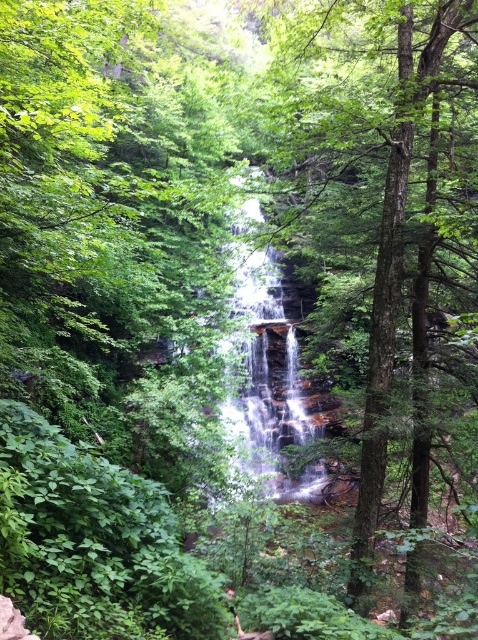
You are a photographer standing at the edge of the forest, aiming to capture a closeup shot of the green rough bark tree at center. Your camera has a minimum focusing distance of 4 meters. Will you be able to take the photo without moving closer?

The green rough bark tree at center is 5.03 meters from the camera, which is beyond the minimum focusing distance of 4 meters. Therefore, you can take the photo without moving closer.

You are a bird flying over the forest scene. You see the green rough bark tree at center and the translucent glass waterfall at center. Which object is taller?

The green rough bark tree at center is taller than the translucent glass waterfall at center.